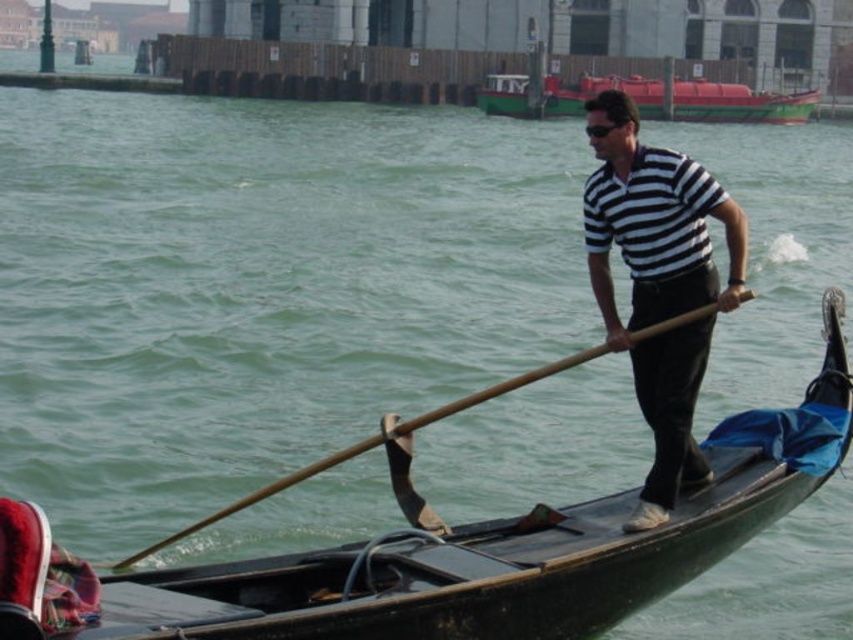
Question: Among these points, which one is nearest to the camera?

Choices:
 (A) (647, 401)
 (B) (526, 380)
 (C) (724, 84)

Answer: (B)

Question: Considering the real-world distances, which object is farthest from the green matte boat at upper center?

Choices:
 (A) wooden at right
 (B) striped cotton shirt at center

Answer: (A)

Question: Which point is farther from the camera taking this photo?

Choices:
 (A) (192, 532)
 (B) (601, 170)

Answer: (B)

Question: Considering the relative positions of green matte boat at upper center and wooden at right in the image provided, where is green matte boat at upper center located with respect to wooden at right?

Choices:
 (A) right
 (B) left

Answer: (A)

Question: Does green matte boat at upper center have a larger size compared to wooden at right?

Choices:
 (A) yes
 (B) no

Answer: (A)

Question: Is the position of striped cotton shirt at center less distant than that of green matte boat at upper center?

Choices:
 (A) no
 (B) yes

Answer: (B)